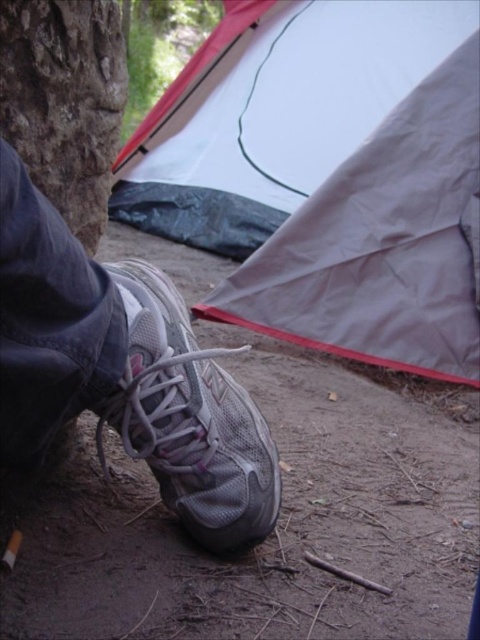
Can you confirm if white nylon tent at center is taller than white mesh shoe at lower left?

Yes, white nylon tent at center is taller than white mesh shoe at lower left.

Who is positioned more to the right, white nylon tent at center or white mesh shoe at lower left?

Positioned to the right is white nylon tent at center.

This screenshot has width=480, height=640. In order to click on white nylon tent at center in this screenshot , I will do `click(347, 177)`.

Describe the element at coordinates (123, 372) in the screenshot. I see `gray mesh shoe at lower left` at that location.

The height and width of the screenshot is (640, 480). Identify the location of gray mesh shoe at lower left. [x=123, y=372].

Is white nylon tent at center closer to the viewer compared to gray mesh shoe at lower left?

No.

Is point (475, 220) positioned behind point (28, 188)?

Yes.

Where is `white nylon tent at center`? Image resolution: width=480 pixels, height=640 pixels. white nylon tent at center is located at coordinates (347, 177).